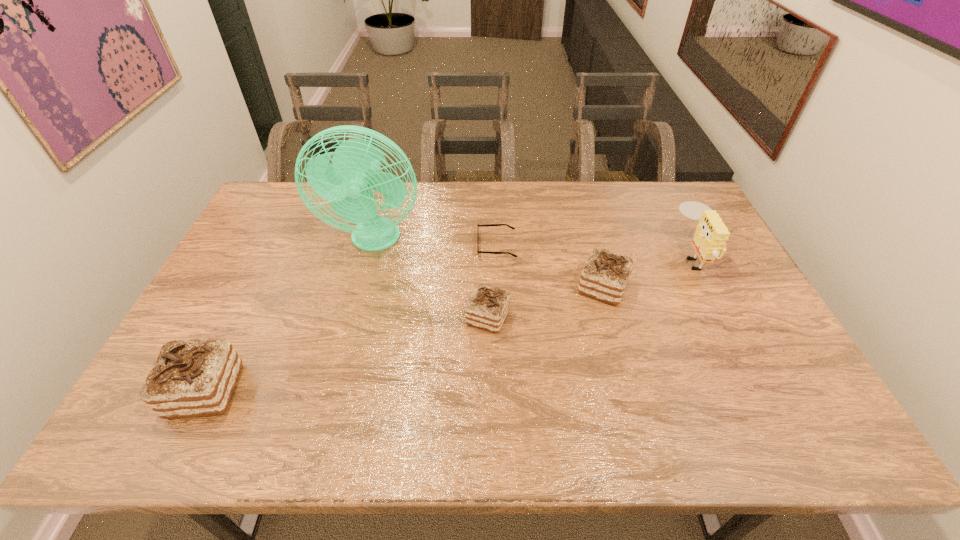
Find the location of a particular element. The image size is (960, 540). location for an additional chocolate_cake to make spacing equal is located at coordinates (357, 352).